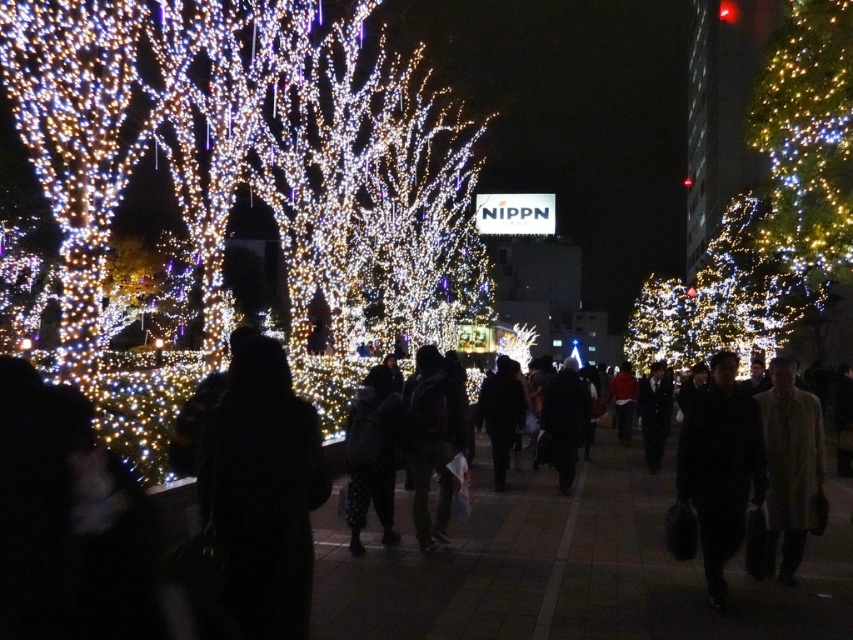
Question: Which point is closer to the camera taking this photo?

Choices:
 (A) (622, 440)
 (B) (548, 440)
 (C) (387, 445)
 (D) (271, 356)

Answer: (D)

Question: Which of the following is the farthest from the observer?

Choices:
 (A) black wool coat at center
 (B) dark gray fabric jacket at center
 (C) dark fabric coat at center

Answer: (C)

Question: Is black wool coat at center behind dark fabric coat at center?

Choices:
 (A) yes
 (B) no

Answer: (B)

Question: Is illuminated plastic tree at right closer to camera compared to black matte jacket at center?

Choices:
 (A) no
 (B) yes

Answer: (A)

Question: Does black matte coat at center appear on the right side of beige wool coat at lower right?

Choices:
 (A) yes
 (B) no

Answer: (A)

Question: Which point is closer to the camera?

Choices:
 (A) 821,108
 (B) 502,355

Answer: (A)